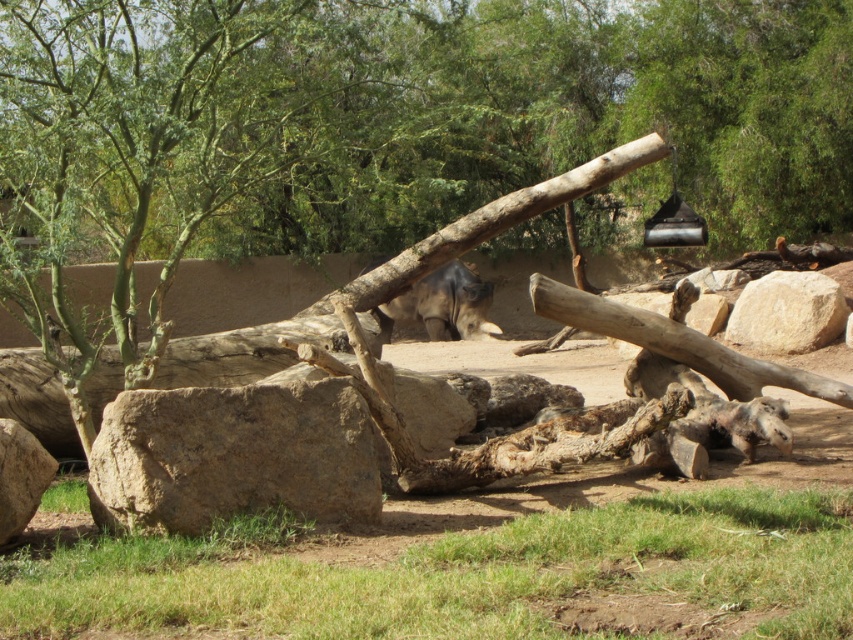
Consider the image. Who is shorter, brown rough tree trunk at center or smooth gray rock at lower left?

Standing shorter between the two is smooth gray rock at lower left.

Where is `brown rough tree trunk at center`? brown rough tree trunk at center is located at coordinates tap(399, 122).

Identify the location of brown rough tree trunk at center. (399, 122).

Identify the location of brown rough tree trunk at center. This screenshot has width=853, height=640. (399, 122).

Who is more distant from viewer, [425,118] or [215,449]?

Positioned behind is point [425,118].

Is point (798, 218) in front of point (99, 467)?

No, (798, 218) is behind (99, 467).

I want to click on brown rough tree trunk at center, so click(399, 122).

Is brown rough rock at lower left below beige rough rock at right?

Yes, brown rough rock at lower left is below beige rough rock at right.

Is brown rough rock at lower left shorter than beige rough rock at right?

Correct, brown rough rock at lower left is not as tall as beige rough rock at right.

The height and width of the screenshot is (640, 853). Identify the location of brown rough rock at lower left. (233, 456).